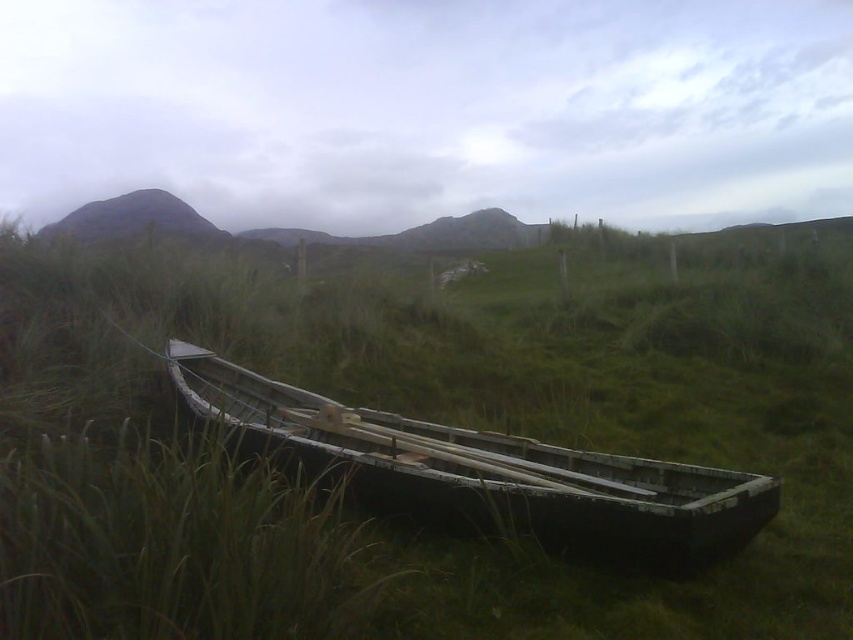
Is point (618, 573) farther from camera compared to point (544, 490)?

No, (618, 573) is in front of (544, 490).

What are the coordinates of `green matte grass at center` in the screenshot? It's located at (505, 400).

This screenshot has width=853, height=640. I want to click on green matte grass at center, so click(505, 400).